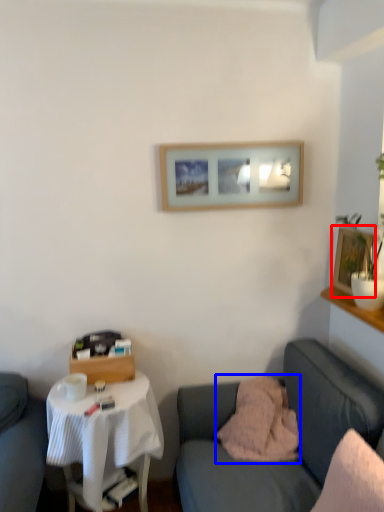
Question: Which object is closer to the camera taking this photo, picture frame (highlighted by a red box) or pillow (highlighted by a blue box)?

Choices:
 (A) picture frame
 (B) pillow

Answer: (B)